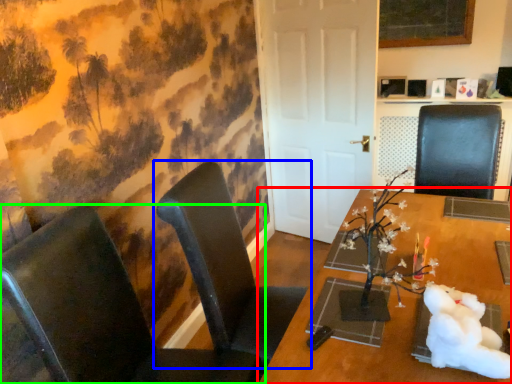
Question: Considering the real-world distances, which object is farthest from table (highlighted by a red box)? chair (highlighted by a blue box) or chair (highlighted by a green box)?

Choices:
 (A) chair
 (B) chair

Answer: (B)